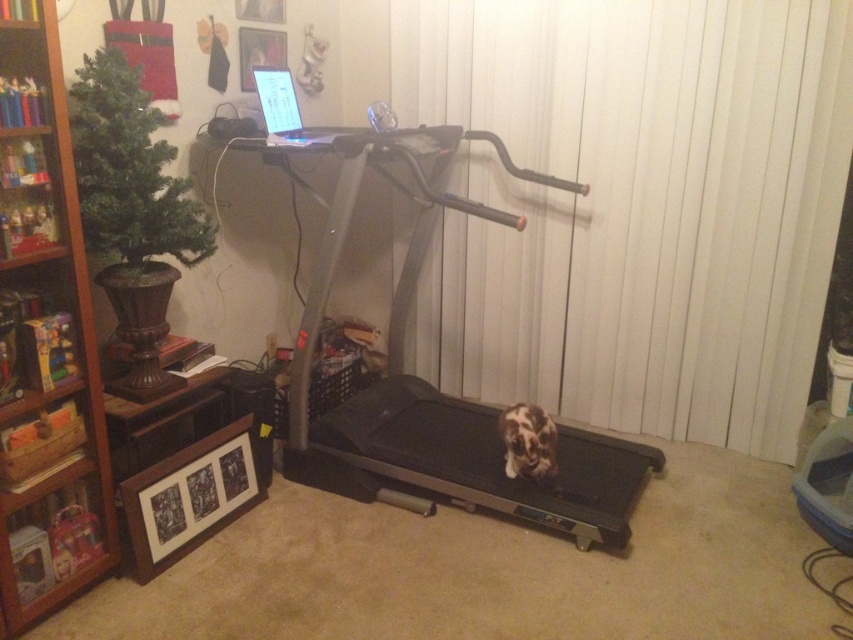
Is wooden bookshelf at left taller than silver metallic treadmill at center?

Indeed, wooden bookshelf at left has a greater height compared to silver metallic treadmill at center.

Between wooden bookshelf at left and silver metallic treadmill at center, which one has more height?

wooden bookshelf at left is taller.

Between point (91, 304) and point (465, 131), which one is positioned behind?

Point (465, 131)

The image size is (853, 640). What are the coordinates of `wooden bookshelf at left` in the screenshot? It's located at (45, 337).